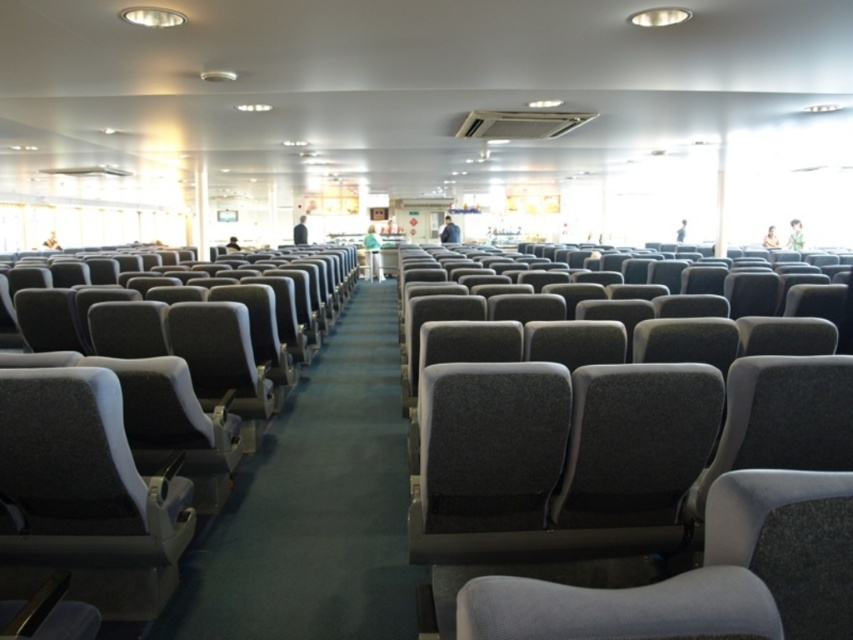
Question: Is gray fabric seat at center thinner than gray fabric seat at left?

Choices:
 (A) yes
 (B) no

Answer: (B)

Question: Among these objects, which one is nearest to the camera?

Choices:
 (A) gray fabric seat at center
 (B) gray fabric seat at left

Answer: (A)

Question: Does gray fabric seat at center appear on the left side of gray fabric seat at left?

Choices:
 (A) no
 (B) yes

Answer: (A)

Question: Can you confirm if gray fabric seat at center is positioned to the right of gray fabric seat at left?

Choices:
 (A) yes
 (B) no

Answer: (A)